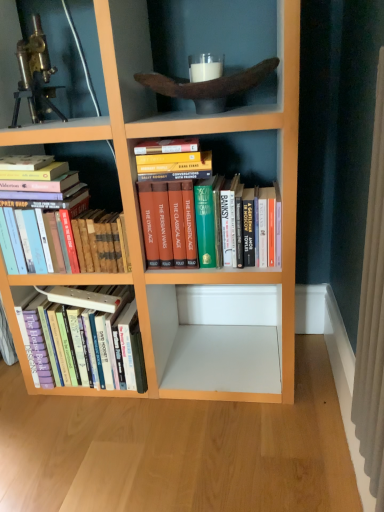
Question: Can you confirm if hardcover books at left, which is the second book in top-to-bottom order, is shorter than brass metallic telescope at upper left?

Choices:
 (A) no
 (B) yes

Answer: (A)

Question: From a real-world perspective, is hardcover books at left, the second book in the bottom-to-top sequence, on brass metallic telescope at upper left?

Choices:
 (A) yes
 (B) no

Answer: (B)

Question: Does hardcover books at left, which is the second book in top-to-bottom order, appear on the left side of brass metallic telescope at upper left?

Choices:
 (A) yes
 (B) no

Answer: (B)

Question: Considering the relative positions of hardcover books at left, the second book in the bottom-to-top sequence, and brass metallic telescope at upper left in the image provided, is hardcover books at left, the second book in the bottom-to-top sequence, in front of brass metallic telescope at upper left?

Choices:
 (A) no
 (B) yes

Answer: (A)

Question: Is hardcover books at left, which is the second book in top-to-bottom order, not close to brass metallic telescope at upper left?

Choices:
 (A) yes
 (B) no

Answer: (B)

Question: Is hardcover books at center, which is the 1th book from top to bottom, inside the boundaries of hardcover books at left, which is the second book in top-to-bottom order, or outside?

Choices:
 (A) outside
 (B) inside

Answer: (A)

Question: Is hardcover books at center, which is the 1th book from top to bottom, in front of or behind hardcover books at left, the second book in the bottom-to-top sequence, in the image?

Choices:
 (A) behind
 (B) front

Answer: (B)

Question: From the image's perspective, is hardcover books at center, which is the third book in bottom-to-top order, positioned above or below hardcover books at left, which is the second book in top-to-bottom order?

Choices:
 (A) above
 (B) below

Answer: (A)

Question: In terms of height, does hardcover books at center, which is the third book in bottom-to-top order, look taller or shorter compared to hardcover books at left, which is the second book in top-to-bottom order?

Choices:
 (A) tall
 (B) short

Answer: (A)

Question: Is hardcover books at left, the 1th book ordered from the bottom, spatially inside brass metallic telescope at upper left, or outside of it?

Choices:
 (A) outside
 (B) inside

Answer: (A)

Question: In the image, is hardcover books at left, the third book from the top, positioned in front of or behind brass metallic telescope at upper left?

Choices:
 (A) behind
 (B) front

Answer: (A)

Question: From a real-world perspective, is hardcover books at left, the third book from the top, positioned above or below brass metallic telescope at upper left?

Choices:
 (A) above
 (B) below

Answer: (B)

Question: Is hardcover books at left, the 1th book ordered from the bottom, bigger or smaller than brass metallic telescope at upper left?

Choices:
 (A) small
 (B) big

Answer: (B)

Question: Is hardcover books at left, the second book in the bottom-to-top sequence, inside or outside of hardcover books at left, the 1th book ordered from the bottom?

Choices:
 (A) outside
 (B) inside

Answer: (A)

Question: From their relative heights in the image, would you say hardcover books at left, which is the second book in top-to-bottom order, is taller or shorter than hardcover books at left, the third book from the top?

Choices:
 (A) tall
 (B) short

Answer: (B)